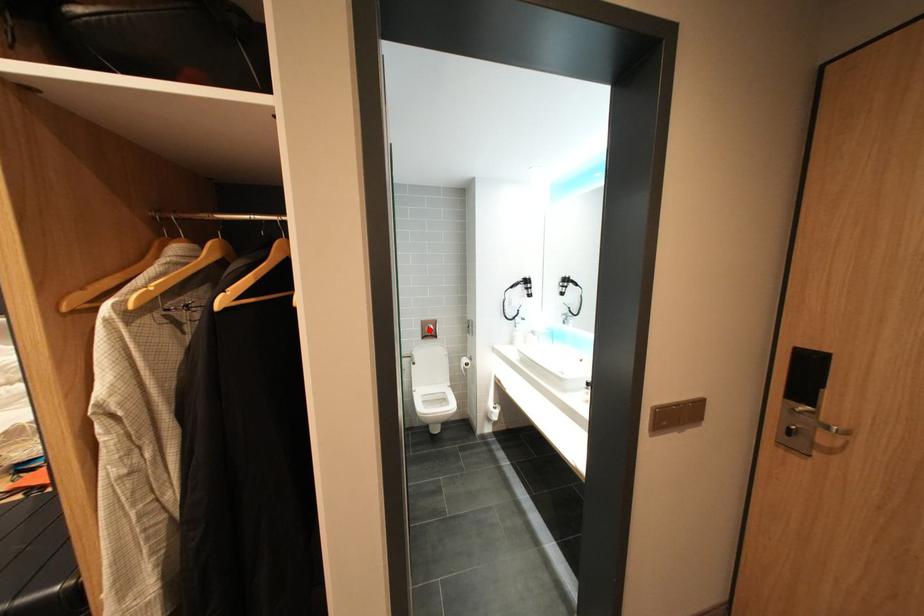
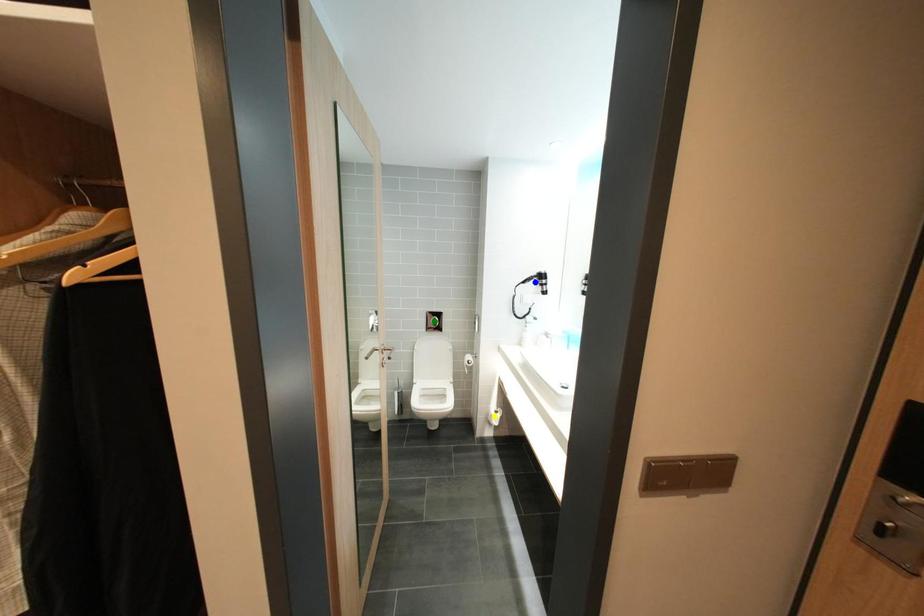
Question: I am providing you with two images of the same scene from different viewpoints. A red point is marked on the first image. You are given multiple points on the second image. Which point in image 2 represents the same 3d spot as the red point in image 1?

Choices:
 (A) green point
 (B) yellow point
 (C) blue point

Answer: (A)